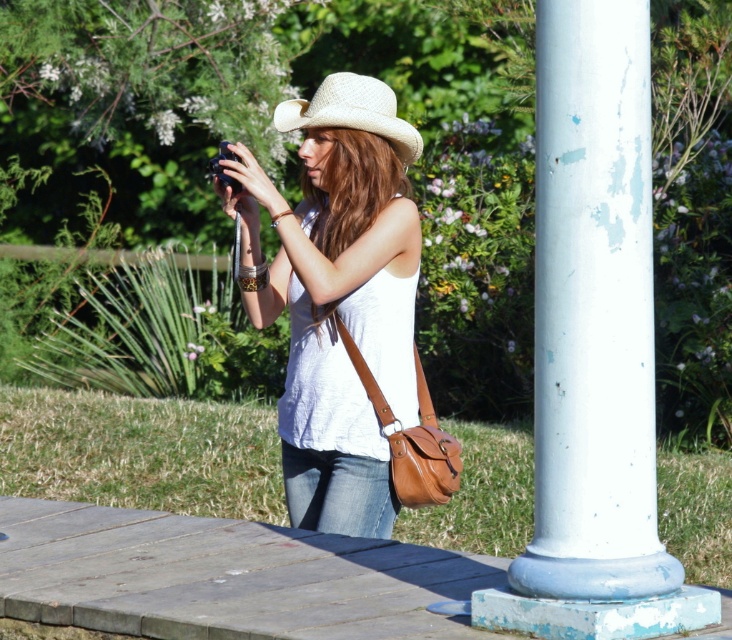
You are a photographer trying to capture a perfect shot. You notice a point at coordinates point (340, 381) in the scene. If your camera is set to focus at 6 meters, will it be able to clearly capture that point?

The point (340, 381) is 6.33 meters away from the camera. Since the camera is set to focus at 6 meters, it might not capture the point clearly as the distance is slightly beyond the focus range.

You are a fashion designer observing a person in the image. You need to determine which item of clothing is taller between the denim jeans at lower center and the woven straw cowboy hat at center. Which one is taller?

The denim jeans at lower center is much taller than the woven straw cowboy hat at center according to the description.